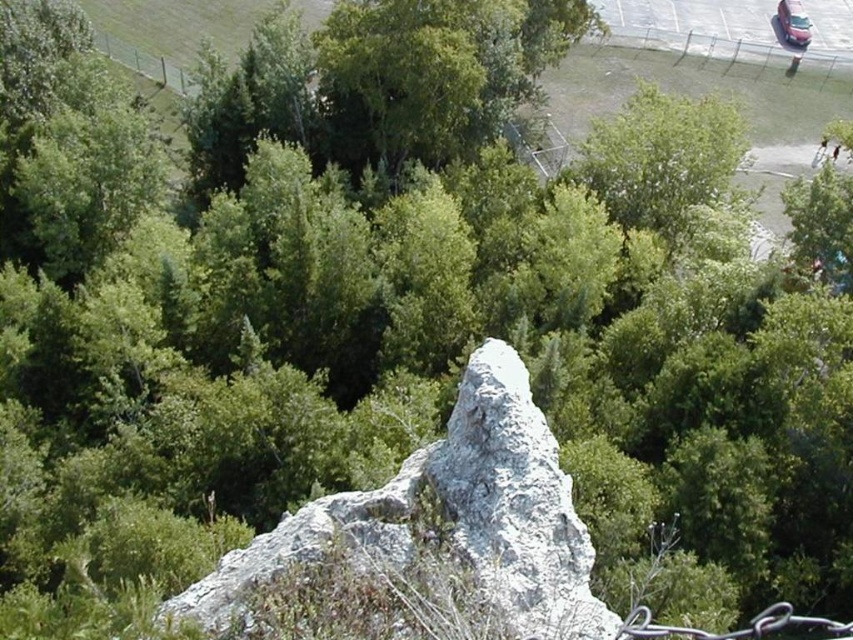
Looking at this image, who is higher up, white rough rock at center or metallic silver car at upper right?

Positioned higher is metallic silver car at upper right.

Is point (479, 364) farther from camera compared to point (796, 26)?

No, it is in front of (796, 26).

Image resolution: width=853 pixels, height=640 pixels. What do you see at coordinates (450, 516) in the screenshot?
I see `white rough rock at center` at bounding box center [450, 516].

The width and height of the screenshot is (853, 640). In order to click on white rough rock at center in this screenshot , I will do `click(450, 516)`.